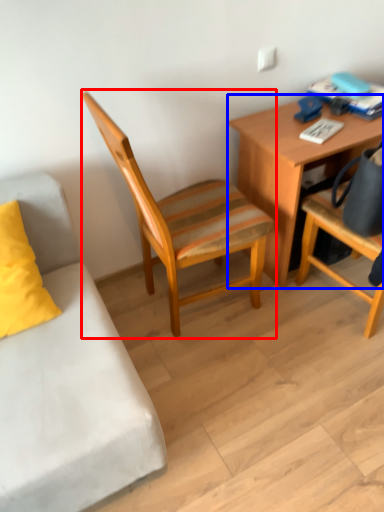
Question: Among these objects, which one is nearest to the camera, chair (highlighted by a red box) or desk (highlighted by a blue box)?

Choices:
 (A) chair
 (B) desk

Answer: (A)